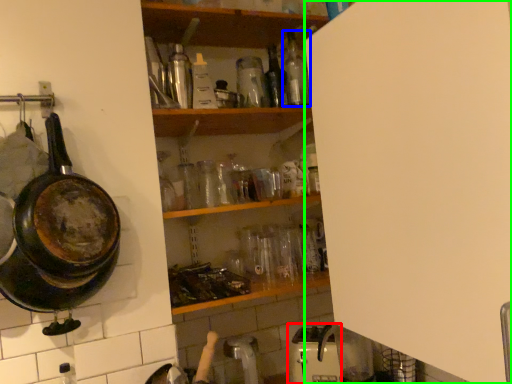
Question: Which object is the farthest from appliance (highlighted by a red box)? Choose among these: bottle (highlighted by a blue box) or side (highlighted by a green box).

Choices:
 (A) bottle
 (B) side

Answer: (A)